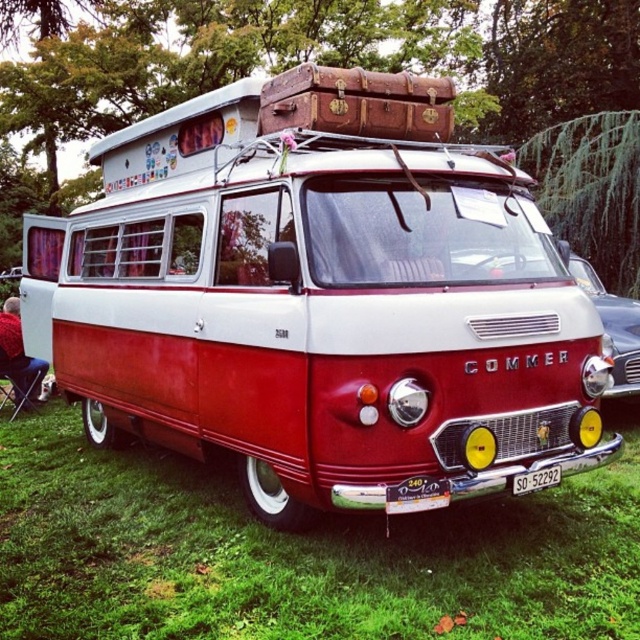
Is shiny red commer van at center closer to camera compared to white plastic license plate at center?

That is False.

Who is more distant from viewer, (596, 301) or (561, 474)?

Point (596, 301)

Identify the location of shiny red commer van at center. The width and height of the screenshot is (640, 640). (611, 326).

Which is behind, point (240, 104) or point (536, 490)?

Point (240, 104)

Does matte red van at center have a smaller size compared to white plastic license plate at center?

Actually, matte red van at center might be larger than white plastic license plate at center.

Which is in front, point (296, 500) or point (540, 484)?

Point (540, 484) is more forward.

This screenshot has width=640, height=640. Find the location of `matte red van at center`. matte red van at center is located at coordinates (320, 300).

Is matte red van at center below shiny red commer van at center?

No, matte red van at center is not below shiny red commer van at center.

Which is behind, point (426, 449) or point (612, 364)?

Point (612, 364)

Is point (227, 333) closer to viewer compared to point (600, 317)?

Yes, point (227, 333) is closer to viewer.

The width and height of the screenshot is (640, 640). I want to click on matte red van at center, so click(x=320, y=300).